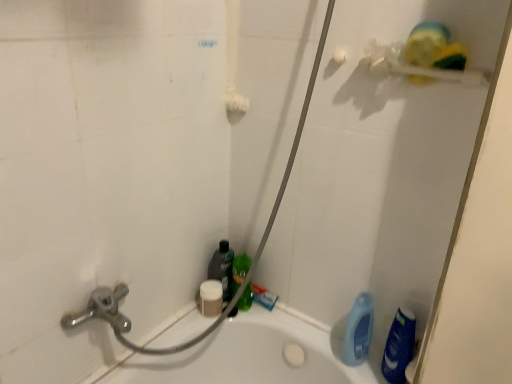
Locate an element on the screen. This screenshot has height=384, width=512. white matte soap at center is located at coordinates (293, 354).

You are a GUI agent. You are given a task and a screenshot of the screen. Output one action in this format:
    pyautogui.click(x=<x>, y=<y>)
    Task: Click on the blue glossy bottle at lower right, the first cleaning product in the right-to-left sequence
    This screenshot has width=512, height=384.
    Given the screenshot: What is the action you would take?
    pyautogui.click(x=399, y=346)

In the scene shown: Measure the distance between point (x=221, y=245) and camera.

A distance of 1.41 meters exists between point (x=221, y=245) and camera.

Locate an element on the screen. The image size is (512, 384). white matte sponge at lower center, the 5th cleaning product when ordered from right to left is located at coordinates (211, 298).

Locate an element on the screen. The image size is (512, 384). blue plastic bottle at lower right, which ranks as the fourth cleaning product in left-to-right order is located at coordinates (358, 331).

Find the location of a particular element. white matte soap at center is located at coordinates (293, 354).

Considering the positions of objects yellow sponge at upper right and white matte sponge at lower center, the 5th cleaning product when ordered from right to left, in the image provided, who is more to the right, yellow sponge at upper right or white matte sponge at lower center, the 5th cleaning product when ordered from right to left,?

From the viewer's perspective, yellow sponge at upper right appears more on the right side.

Who is shorter, yellow sponge at upper right or white matte sponge at lower center, arranged as the 1th cleaning product when viewed from the left?

white matte sponge at lower center, arranged as the 1th cleaning product when viewed from the left.

Looking at the image, does yellow sponge at upper right seem bigger or smaller compared to white matte sponge at lower center, arranged as the 1th cleaning product when viewed from the left?

Clearly, yellow sponge at upper right is larger in size than white matte sponge at lower center, arranged as the 1th cleaning product when viewed from the left.

In the image, is white matte soap at center positioned in front of or behind blue plastic bottle at lower right, acting as the 2th cleaning product starting from the right?

white matte soap at center is behind blue plastic bottle at lower right, acting as the 2th cleaning product starting from the right.

Considering the sizes of white matte soap at center and blue plastic bottle at lower right, which ranks as the fourth cleaning product in left-to-right order, in the image, is white matte soap at center wider or thinner than blue plastic bottle at lower right, which ranks as the fourth cleaning product in left-to-right order,?

Considering their sizes, white matte soap at center looks broader than blue plastic bottle at lower right, which ranks as the fourth cleaning product in left-to-right order.

From a real-world perspective, does white matte soap at center sit lower than blue plastic bottle at lower right, acting as the 2th cleaning product starting from the right?

Yes, from a real-world perspective, white matte soap at center is beneath blue plastic bottle at lower right, acting as the 2th cleaning product starting from the right.

Does white matte soap at center lie behind white matte sponge at lower center, the 5th cleaning product when ordered from right to left?

No, white matte soap at center is closer to the camera.

Is white matte soap at center wider than white matte sponge at lower center, arranged as the 1th cleaning product when viewed from the left?

Yes, white matte soap at center is wider than white matte sponge at lower center, arranged as the 1th cleaning product when viewed from the left.

Is white matte soap at center taller than white matte sponge at lower center, arranged as the 1th cleaning product when viewed from the left?

In fact, white matte soap at center may be shorter than white matte sponge at lower center, arranged as the 1th cleaning product when viewed from the left.

In the scene shown: Is white matte soap at center oriented towards white matte sponge at lower center, the 5th cleaning product when ordered from right to left?

No, white matte soap at center is not aimed at white matte sponge at lower center, the 5th cleaning product when ordered from right to left.

Considering the relative sizes of translucent plastic bottle at lower center, which ranks as the 4th cleaning product in right-to-left order, and white matte sponge at lower center, arranged as the 1th cleaning product when viewed from the left, in the image provided, is translucent plastic bottle at lower center, which ranks as the 4th cleaning product in right-to-left order, smaller than white matte sponge at lower center, arranged as the 1th cleaning product when viewed from the left,?

Actually, translucent plastic bottle at lower center, which ranks as the 4th cleaning product in right-to-left order, might be larger than white matte sponge at lower center, arranged as the 1th cleaning product when viewed from the left.

Is point (232, 262) positioned behind point (204, 300)?

That is True.

From the translucent plastic bottle at lower center, which ranks as the 4th cleaning product in right-to-left order, count 2nd cleaning products forward and point to it. Please provide its 2D coordinates.

[(211, 298)]

From the picture: How much distance is there between translucent plastic bottle at lower center, which ranks as the second cleaning product in left-to-right order, and white matte sponge at lower center, the 5th cleaning product when ordered from right to left?

The distance of translucent plastic bottle at lower center, which ranks as the second cleaning product in left-to-right order, from white matte sponge at lower center, the 5th cleaning product when ordered from right to left, is 2.30 inches.

Considering the relative sizes of white matte soap at center and yellow sponge at upper right in the image provided, is white matte soap at center taller than yellow sponge at upper right?

Incorrect, the height of white matte soap at center is not larger of that of yellow sponge at upper right.

Would you say white matte soap at center is to the left or to the right of yellow sponge at upper right in the picture?

white matte soap at center is positioned on yellow sponge at upper right's left side.

Considering the points (289, 360) and (470, 83), which point is behind, point (289, 360) or point (470, 83)?

Point (289, 360)

Is the depth of white matte soap at center less than that of yellow sponge at upper right?

That is False.

Is blue glossy bottle at lower right, placed as the 5th cleaning product when sorted from left to right, positioned with its back to green matte bottle at center, which appears as the third cleaning product when viewed from the left?

No.

Considering the relative sizes of blue glossy bottle at lower right, the first cleaning product in the right-to-left sequence, and green matte bottle at center, which appears as the third cleaning product when viewed from the left, in the image provided, is blue glossy bottle at lower right, the first cleaning product in the right-to-left sequence, shorter than green matte bottle at center, which appears as the third cleaning product when viewed from the left,?

In fact, blue glossy bottle at lower right, the first cleaning product in the right-to-left sequence, may be taller than green matte bottle at center, which appears as the third cleaning product when viewed from the left.

Does blue glossy bottle at lower right, the first cleaning product in the right-to-left sequence, have a lesser width compared to green matte bottle at center, the third cleaning product in the right-to-left sequence?

Indeed, blue glossy bottle at lower right, the first cleaning product in the right-to-left sequence, has a lesser width compared to green matte bottle at center, the third cleaning product in the right-to-left sequence.

Would you consider blue glossy bottle at lower right, the first cleaning product in the right-to-left sequence, to be distant from green matte bottle at center, the third cleaning product in the right-to-left sequence?

blue glossy bottle at lower right, the first cleaning product in the right-to-left sequence, is actually quite close to green matte bottle at center, the third cleaning product in the right-to-left sequence.

In terms of height, does blue plastic bottle at lower right, which ranks as the fourth cleaning product in left-to-right order, look taller or shorter compared to blue glossy bottle at lower right, the first cleaning product in the right-to-left sequence?

blue plastic bottle at lower right, which ranks as the fourth cleaning product in left-to-right order, is shorter than blue glossy bottle at lower right, the first cleaning product in the right-to-left sequence.

This screenshot has height=384, width=512. In order to click on the 1st cleaning product behind the blue glossy bottle at lower right, placed as the 5th cleaning product when sorted from left to right in this screenshot , I will do `click(358, 331)`.

From a real-world perspective, who is located lower, blue plastic bottle at lower right, acting as the 2th cleaning product starting from the right, or blue glossy bottle at lower right, placed as the 5th cleaning product when sorted from left to right?

In real-world perspective, blue glossy bottle at lower right, placed as the 5th cleaning product when sorted from left to right, is lower.

From the image's perspective, which one is positioned lower, blue plastic bottle at lower right, acting as the 2th cleaning product starting from the right, or blue glossy bottle at lower right, placed as the 5th cleaning product when sorted from left to right?

From the image's view, blue glossy bottle at lower right, placed as the 5th cleaning product when sorted from left to right, is below.

Locate an element on the screen. This screenshot has width=512, height=384. shower above the white matte sponge at lower center, the 5th cleaning product when ordered from right to left (from the image's perspective) is located at coordinates (418, 67).

Identify the location of soap below the blue plastic bottle at lower right, which ranks as the fourth cleaning product in left-to-right order (from the image's perspective). (293, 354).

From the image, which object appears to be nearer to blue plastic bottle at lower right, which ranks as the fourth cleaning product in left-to-right order, yellow sponge at upper right or translucent plastic bottle at lower center, which ranks as the 4th cleaning product in right-to-left order?

translucent plastic bottle at lower center, which ranks as the 4th cleaning product in right-to-left order, is positioned closer to the anchor blue plastic bottle at lower right, which ranks as the fourth cleaning product in left-to-right order.

Based on their spatial positions, is blue glossy bottle at lower right, placed as the 5th cleaning product when sorted from left to right, or translucent plastic bottle at lower center, which ranks as the 4th cleaning product in right-to-left order, closer to green matte bottle at center, which appears as the third cleaning product when viewed from the left?

Among the two, translucent plastic bottle at lower center, which ranks as the 4th cleaning product in right-to-left order, is located nearer to green matte bottle at center, which appears as the third cleaning product when viewed from the left.

Estimate the real-world distances between objects in this image. Which object is closer to blue plastic bottle at lower right, acting as the 2th cleaning product starting from the right, yellow sponge at upper right or white matte soap at center?

white matte soap at center is positioned closer to the anchor blue plastic bottle at lower right, acting as the 2th cleaning product starting from the right.

In the scene shown: Which object lies further to the anchor point yellow sponge at upper right, white matte sponge at lower center, arranged as the 1th cleaning product when viewed from the left, or blue plastic bottle at lower right, acting as the 2th cleaning product starting from the right?

white matte sponge at lower center, arranged as the 1th cleaning product when viewed from the left, is further to yellow sponge at upper right.

Estimate the real-world distances between objects in this image. Which object is closer to white matte sponge at lower center, the 5th cleaning product when ordered from right to left, yellow sponge at upper right or translucent plastic bottle at lower center, which ranks as the second cleaning product in left-to-right order?

Based on the image, translucent plastic bottle at lower center, which ranks as the second cleaning product in left-to-right order, appears to be nearer to white matte sponge at lower center, the 5th cleaning product when ordered from right to left.

From the image, which object appears to be nearer to blue glossy bottle at lower right, placed as the 5th cleaning product when sorted from left to right, white matte soap at center or white matte sponge at lower center, the 5th cleaning product when ordered from right to left?

white matte soap at center.

Estimate the real-world distances between objects in this image. Which object is closer to white matte soap at center, yellow sponge at upper right or green matte bottle at center, the third cleaning product in the right-to-left sequence?

green matte bottle at center, the third cleaning product in the right-to-left sequence, is closer to white matte soap at center.

Looking at the image, which one is located further to translucent plastic bottle at lower center, which ranks as the second cleaning product in left-to-right order, blue glossy bottle at lower right, placed as the 5th cleaning product when sorted from left to right, or yellow sponge at upper right?

yellow sponge at upper right is further to translucent plastic bottle at lower center, which ranks as the second cleaning product in left-to-right order.

This screenshot has height=384, width=512. Find the location of `cleaning product between white matte soap at center and blue glossy bottle at lower right, the first cleaning product in the right-to-left sequence, from left to right`. cleaning product between white matte soap at center and blue glossy bottle at lower right, the first cleaning product in the right-to-left sequence, from left to right is located at coordinates (358, 331).

Find the location of `soap located between white matte sponge at lower center, arranged as the 1th cleaning product when viewed from the left, and blue plastic bottle at lower right, which ranks as the fourth cleaning product in left-to-right order, in the left-right direction`. soap located between white matte sponge at lower center, arranged as the 1th cleaning product when viewed from the left, and blue plastic bottle at lower right, which ranks as the fourth cleaning product in left-to-right order, in the left-right direction is located at coordinates (293, 354).

Where is `cleaning product that lies between yellow sponge at upper right and green matte bottle at center, which appears as the third cleaning product when viewed from the left, from top to bottom`? The width and height of the screenshot is (512, 384). cleaning product that lies between yellow sponge at upper right and green matte bottle at center, which appears as the third cleaning product when viewed from the left, from top to bottom is located at coordinates (222, 268).

Find the location of a particular element. The height and width of the screenshot is (384, 512). soap between translucent plastic bottle at lower center, which ranks as the 4th cleaning product in right-to-left order, and blue glossy bottle at lower right, placed as the 5th cleaning product when sorted from left to right is located at coordinates (293, 354).